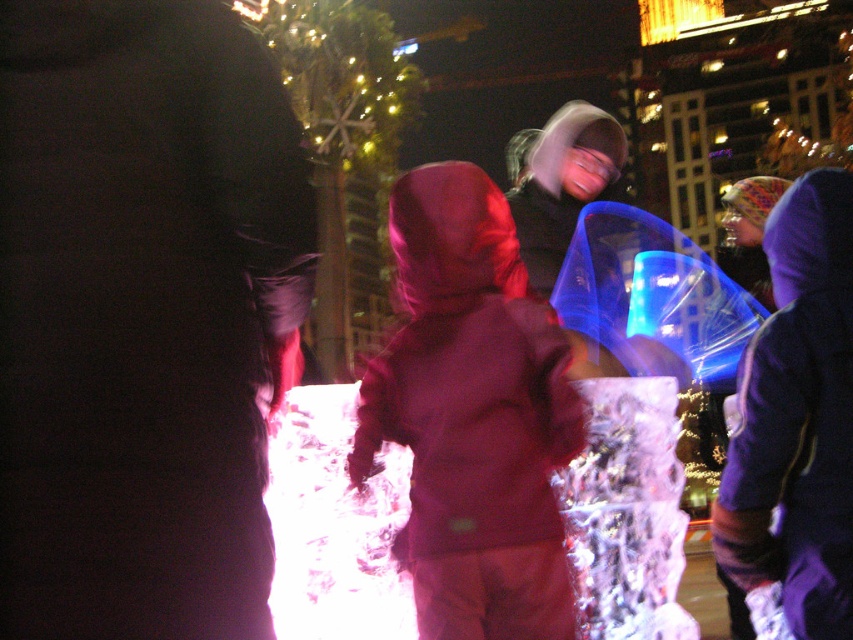
You are a delivery robot with a 2.5 meter wide package. You need to move through the space between the matte black jacket at center and the purple fleece jacket at right. Can your package fit through the space between them?

The distance between the matte black jacket at center and the purple fleece jacket at right is 3.78 meters. Since the package is 2.5 meters wide, it can fit through the space as the distance is wider than the package.